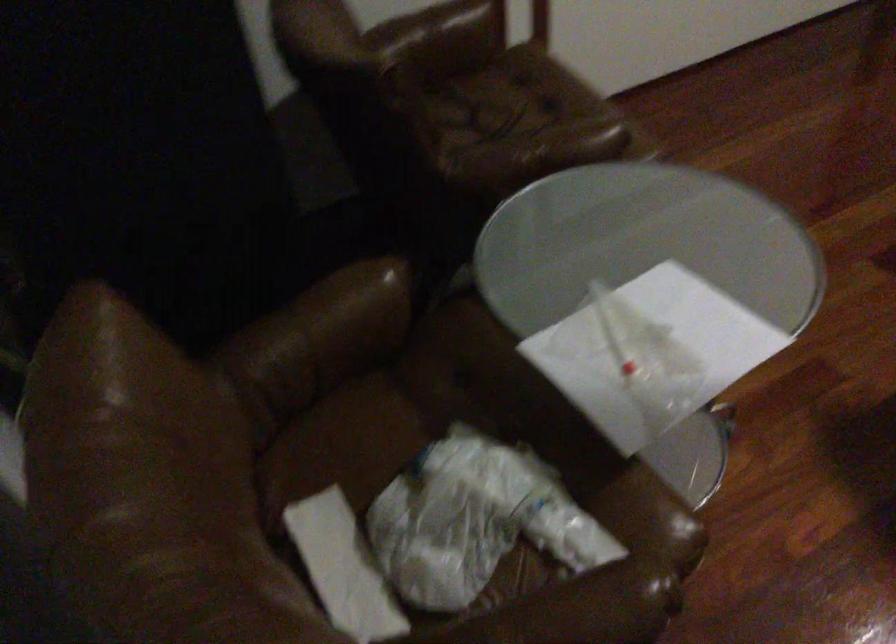
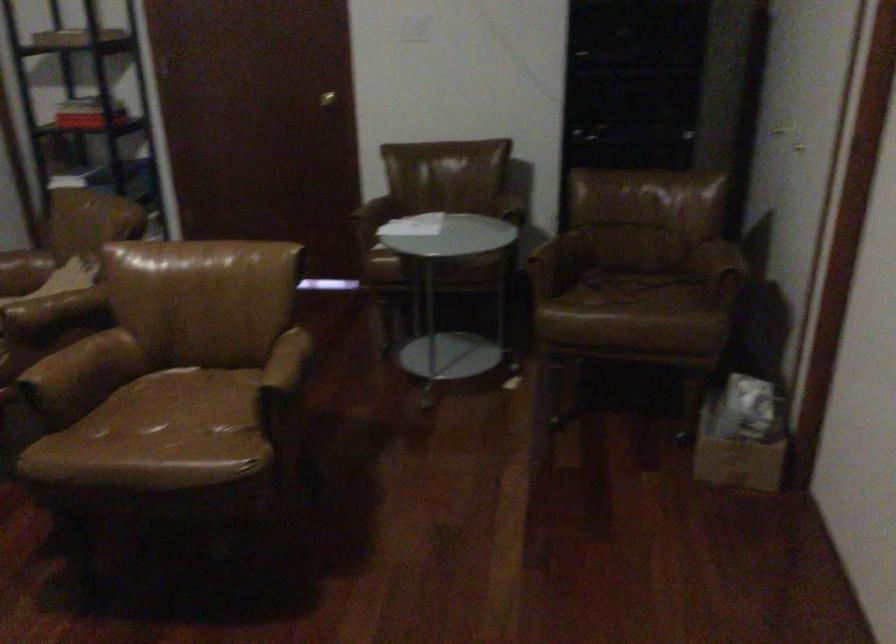
Where in the second image is the point corresponding to (x=502, y=118) from the first image?

(627, 288)